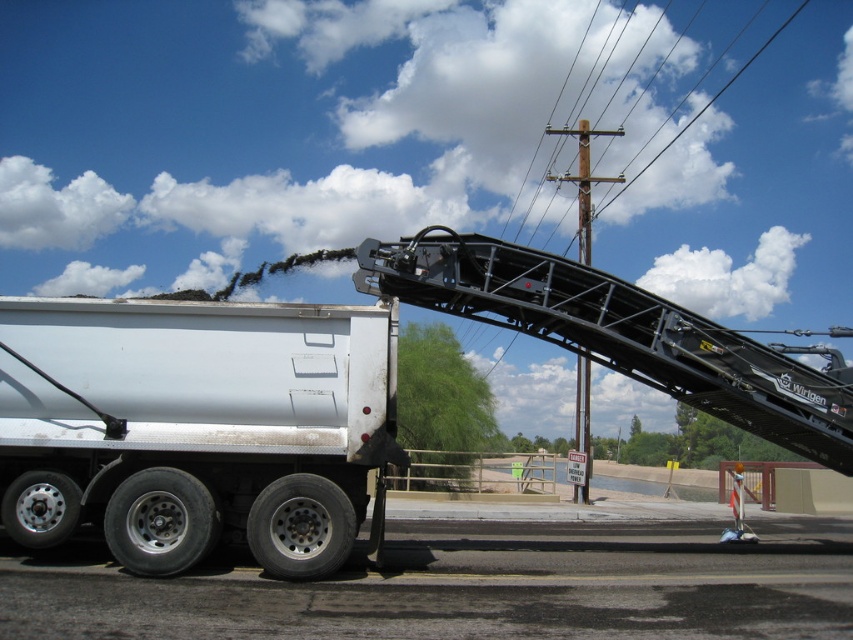
You are an electrician assessing the construction site. You notice the brown wooden telegraph pole at upper center and the black metal power line at upper center. Which object is narrower in width?

The brown wooden telegraph pole at upper center is narrower in width compared to the black metal power line at upper center.

You are a construction worker planning to install a new utility pole in this area. The brown wooden telegraph pole at upper center and the black metal power line at upper center are already present. Based on their current positions, which object is directly above the other?

The black metal power line at upper center is directly above the brown wooden telegraph pole at upper center because the pole is positioned under the power line.

You are a construction worker planning to place a 3m wide equipment between the white matte truck at lower left and the black metal power line at upper center. Can you fit the equipment between them?

The white matte truck at lower left occupies less space than the black metal power line at upper center, so there is enough space to fit the 3m wide equipment between them.